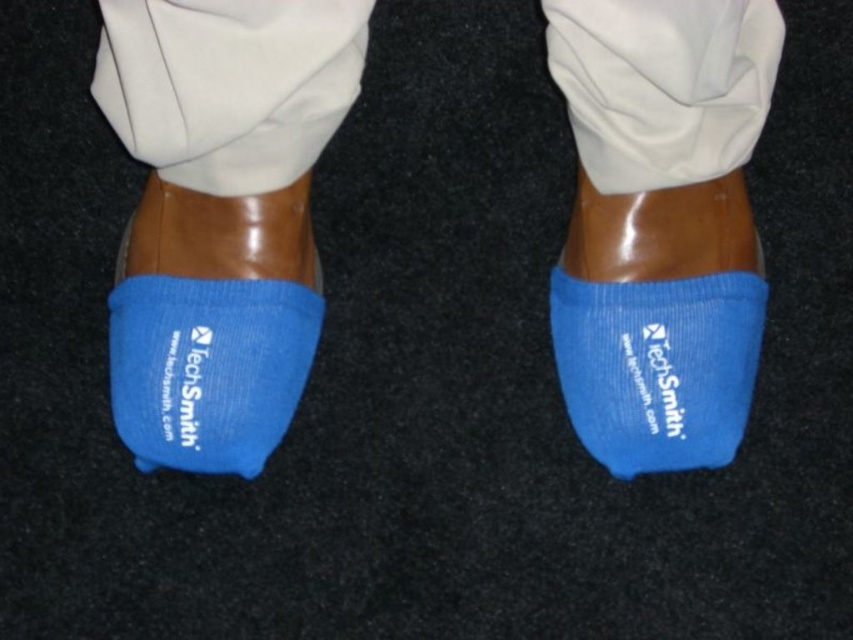
You are a photographer setting up a shoot in a dark room with a dark floor. You need to ensure that the blue fabric socks at center and the blue fabric sock at lower left are clearly visible. Which sock should you place a spotlight on to highlight its position over the other?

The blue fabric socks at center should be highlighted because it is positioned over the blue fabric sock at lower left, making it the top layer and more prominent in the image.